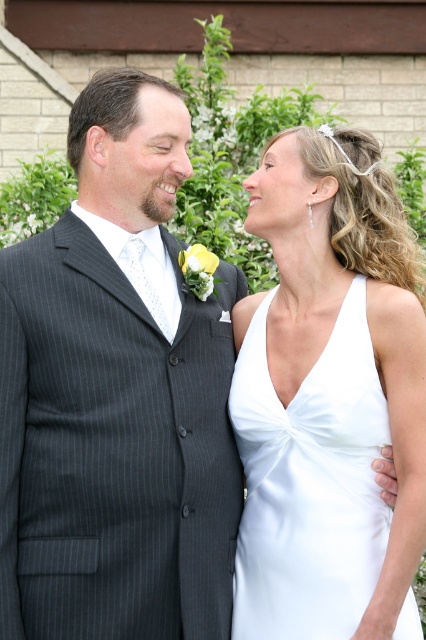
Does dark gray pinstripe suit at center have a greater height compared to white satin dress at center?

Yes, dark gray pinstripe suit at center is taller than white satin dress at center.

Looking at this image, who is more forward, (92, 236) or (301, 570)?

Point (301, 570) is more forward.

At what (x,y) coordinates should I click in order to perform the action: click on dark gray pinstripe suit at center. Please return your answer as a coordinate pair (x, y). Looking at the image, I should click on (117, 396).

I want to click on dark gray pinstripe suit at center, so click(117, 396).